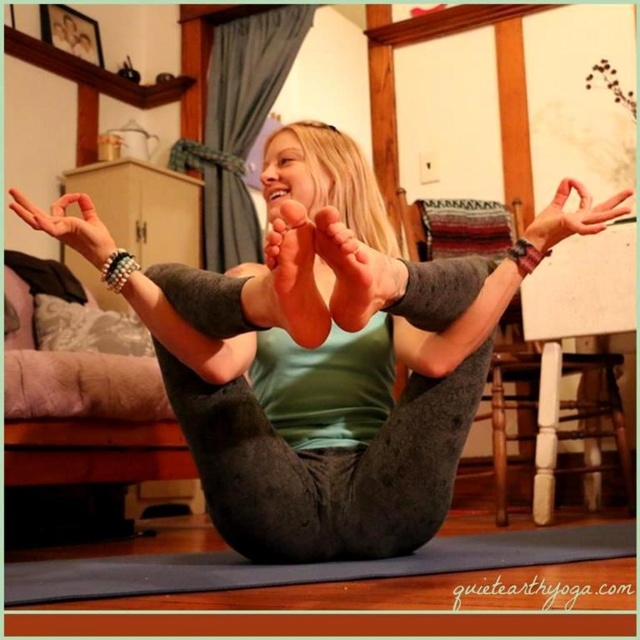
Who is more forward, (195, 403) or (344, 269)?

Positioned in front is point (344, 269).

Between point (275, 419) and point (369, 300), which one is positioned behind?

The point (275, 419) is more distant.

This screenshot has height=640, width=640. Identify the location of gray fleece leggings at center. (321, 369).

Which is behind, point (371, 310) or point (106, 257)?

Positioned behind is point (106, 257).

Can you confirm if matte gray foot at center is wider than matte black bracelet at upper left?

No, matte gray foot at center is not wider than matte black bracelet at upper left.

Who is more distant from viewer, (381, 298) or (72, 232)?

Positioned behind is point (72, 232).

Locate an element on the screen. matte gray foot at center is located at coordinates (355, 273).

Does gray rubber yoga mat at lower center come behind matte gray hand at upper center?

No, it is not.

Is gray rubber yoga mat at lower center taller than matte gray hand at upper center?

No, gray rubber yoga mat at lower center is not taller than matte gray hand at upper center.

Locate an element on the screen. The height and width of the screenshot is (640, 640). gray rubber yoga mat at lower center is located at coordinates (305, 564).